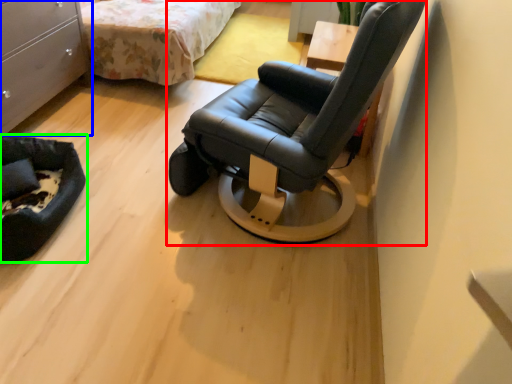
Question: Based on their relative distances, which object is farther from chair (highlighted by a red box)? Choose from chest of drawers (highlighted by a blue box) and furniture (highlighted by a green box).

Choices:
 (A) chest of drawers
 (B) furniture

Answer: (A)